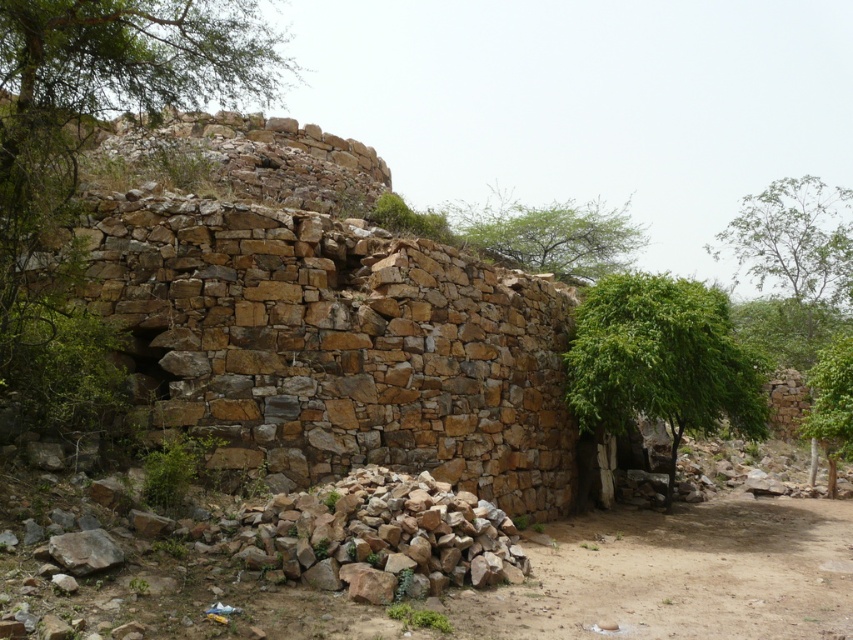
In the scene shown: Can you confirm if green leafy tree at center is positioned below green leafy tree at right?

Actually, green leafy tree at center is above green leafy tree at right.

Which is in front, point (704, 339) or point (836, 387)?

Positioned in front is point (704, 339).

What do you see at coordinates (660, 360) in the screenshot? I see `green leafy tree at center` at bounding box center [660, 360].

Find the location of `green leafy tree at center`. green leafy tree at center is located at coordinates (660, 360).

Does green leafy tree at upper right have a lesser height compared to green leafy tree at right?

No, green leafy tree at upper right is not shorter than green leafy tree at right.

Is point (782, 289) positioned in front of point (828, 440)?

No, it is behind (828, 440).

Which is behind, point (833, 204) or point (817, 417)?

Point (833, 204)

Locate an element on the screen. green leafy tree at upper right is located at coordinates (795, 243).

Which of these two, green leafy tree at upper center or green leafy tree at right, stands taller?

green leafy tree at upper center is taller.

The image size is (853, 640). Describe the element at coordinates (549, 236) in the screenshot. I see `green leafy tree at upper center` at that location.

The image size is (853, 640). Identify the location of green leafy tree at upper center. (549, 236).

This screenshot has height=640, width=853. Identify the location of green leafy tree at upper center. (549, 236).